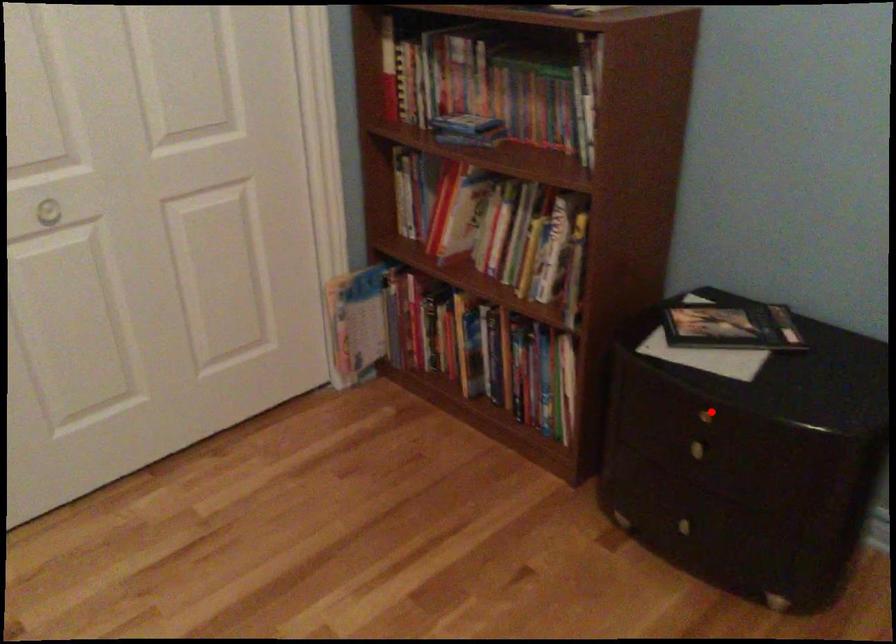
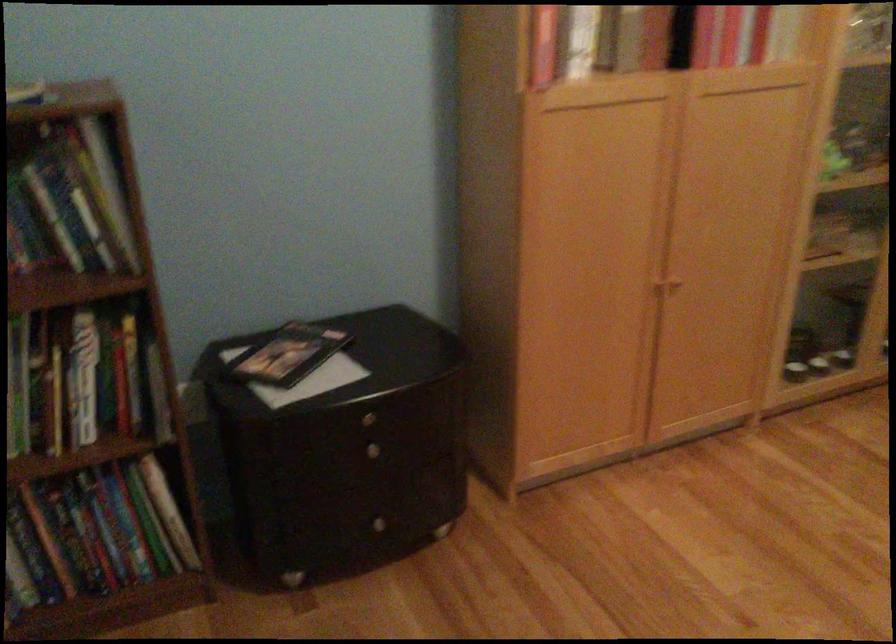
The point at the highlighted location is marked in the first image. Where is the corresponding point in the second image?

(367, 415)